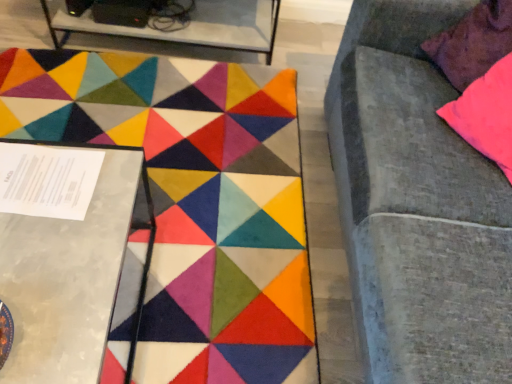
Question: From a real-world perspective, is carpet with geometric patterns at center physically below metallic silver table at left, which is the 2th table in back-to-front order?

Choices:
 (A) no
 (B) yes

Answer: (B)

Question: Does carpet with geometric patterns at center have a lesser width compared to metallic silver table at left, positioned as the second table in top-to-bottom order?

Choices:
 (A) yes
 (B) no

Answer: (B)

Question: Can you confirm if carpet with geometric patterns at center is bigger than metallic silver table at left, which is the 2th table in back-to-front order?

Choices:
 (A) yes
 (B) no

Answer: (B)

Question: Is carpet with geometric patterns at center positioned beyond the bounds of metallic silver table at left, which is the 2th table in back-to-front order?

Choices:
 (A) no
 (B) yes

Answer: (B)

Question: Is there a large distance between carpet with geometric patterns at center and metallic silver table at left, positioned as the second table in top-to-bottom order?

Choices:
 (A) yes
 (B) no

Answer: (B)

Question: Is carpet with geometric patterns at center situated inside pink fabric pillow at upper right or outside?

Choices:
 (A) outside
 (B) inside

Answer: (A)

Question: From a real-world perspective, is carpet with geometric patterns at center physically located above or below pink fabric pillow at upper right?

Choices:
 (A) above
 (B) below

Answer: (B)

Question: Is carpet with geometric patterns at center in front of or behind pink fabric pillow at upper right in the image?

Choices:
 (A) front
 (B) behind

Answer: (A)

Question: From the image's perspective, is carpet with geometric patterns at center above or below pink fabric pillow at upper right?

Choices:
 (A) below
 (B) above

Answer: (A)

Question: Considering their positions, is metallic silver table at left, positioned as the 1th table in bottom-to-top order, located in front of or behind metallic glass table at upper left, acting as the first table starting from the top?

Choices:
 (A) front
 (B) behind

Answer: (A)

Question: Is metallic silver table at left, which is the 2th table in back-to-front order, inside the boundaries of metallic glass table at upper left, placed as the 2th table when sorted from bottom to top, or outside?

Choices:
 (A) outside
 (B) inside

Answer: (A)

Question: Is metallic silver table at left, positioned as the second table in top-to-bottom order, to the left or to the right of metallic glass table at upper left, arranged as the 2th table when viewed from the front, in the image?

Choices:
 (A) left
 (B) right

Answer: (A)

Question: Is metallic silver table at left, positioned as the 1th table in bottom-to-top order, taller or shorter than metallic glass table at upper left, acting as the first table starting from the top?

Choices:
 (A) tall
 (B) short

Answer: (A)

Question: Looking at the image, does pink fabric pillow at upper right seem bigger or smaller compared to metallic silver table at left, placed as the first table when sorted from front to back?

Choices:
 (A) big
 (B) small

Answer: (B)

Question: Relative to metallic silver table at left, placed as the first table when sorted from front to back, is pink fabric pillow at upper right in front or behind?

Choices:
 (A) front
 (B) behind

Answer: (B)